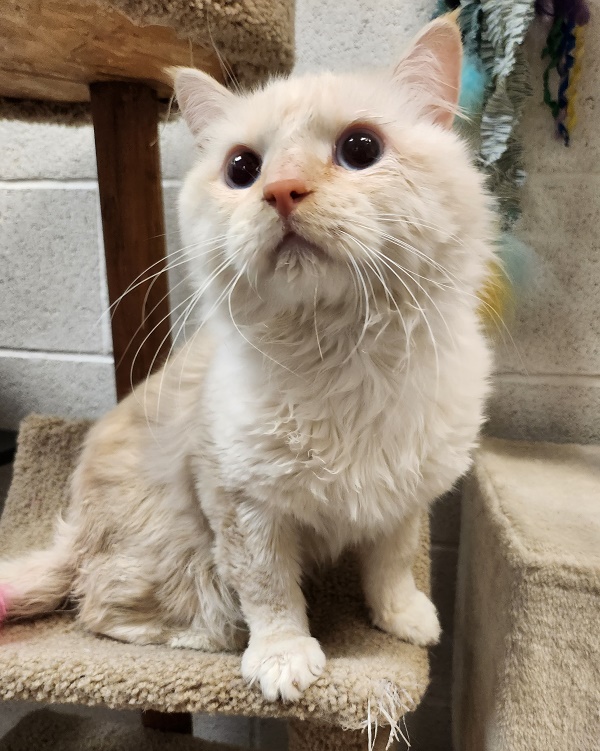
Locate an element on the screen. The height and width of the screenshot is (751, 600). cat toy is located at coordinates (x=498, y=122), (x=567, y=47), (x=472, y=17).